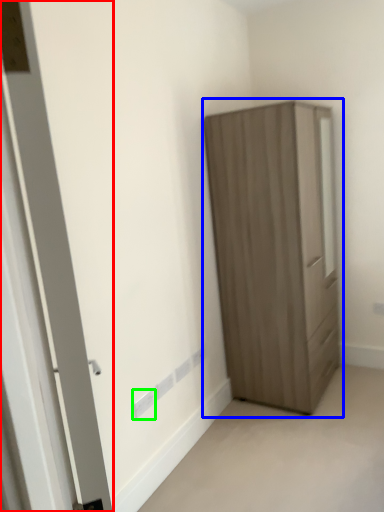
Question: Which object is positioned closest to door (highlighted by a red box)? Select from cupboard (highlighted by a blue box) and electric outlet (highlighted by a green box).

Choices:
 (A) cupboard
 (B) electric outlet

Answer: (B)